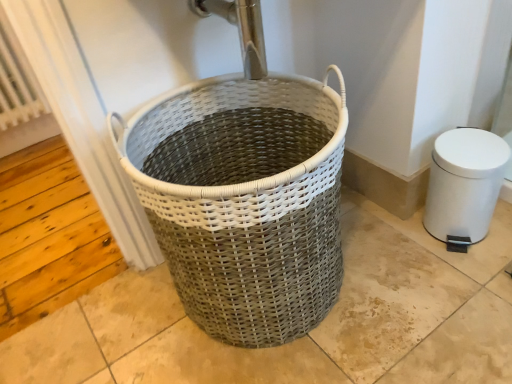
Find the location of `free space in front of white plastic bidet at right`. free space in front of white plastic bidet at right is located at coordinates (471, 281).